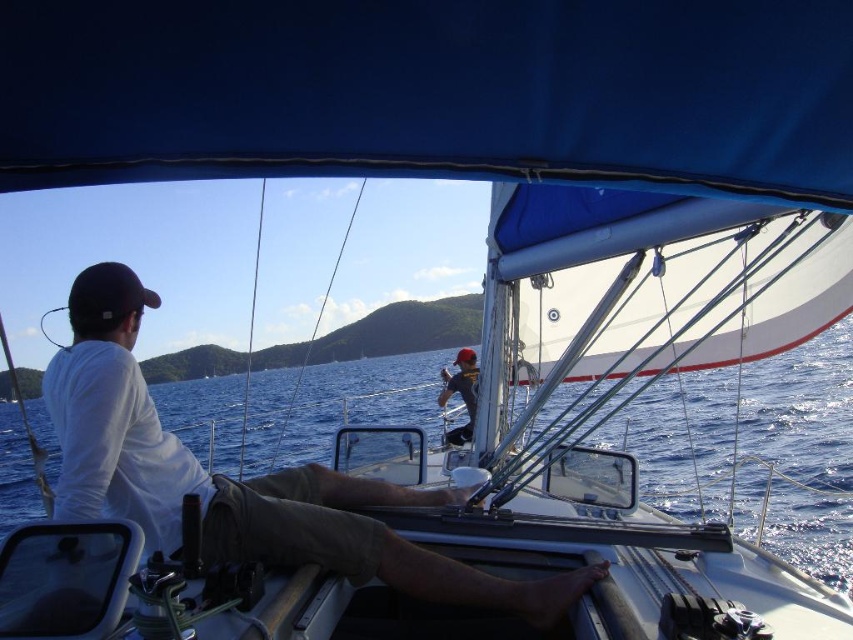
You are standing on the deck of the sailboat and want to know which object is taller between the blue water at center and the dark gray fabric cap at upper center. Can you determine this?

The blue water at center has a greater height compared to the dark gray fabric cap at upper center, so the blue water at center is taller.

You are a photographer trying to capture the sailboat scene. You notice two points marked on your camera screen at coordinates point [817,362] and point [473,388]. Which point is closer to your camera lens?

Point [817,362] is further to the camera than point [473,388], so the point closer to the camera lens is point [473,388].

Looking at this image, you are a sailor on the deck of the sailboat. You need to determine if the blue water at center can fit horizontally next to the dark gray fabric cap at upper center without overlapping. Based on their widths, will they fit side by side?

The blue water at center is wider than the dark gray fabric cap at upper center. Since the blue water at center is wider, placing them side by side would require more space than the dark gray fabric cap at upper center alone, so they cannot fit without overlapping.